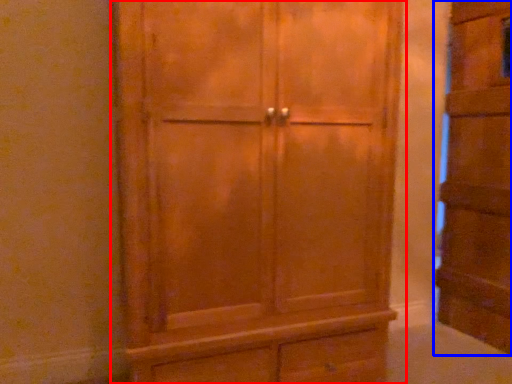
Question: Among these objects, which one is farthest to the camera, cupboard (highlighted by a red box) or cupboard (highlighted by a blue box)?

Choices:
 (A) cupboard
 (B) cupboard

Answer: (B)